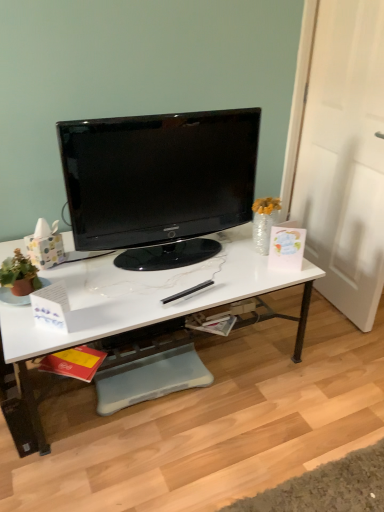
You are a GUI agent. You are given a task and a screenshot of the screen. Output one action in this format:
    pyautogui.click(x=<x>, y=<y>)
    Task: Click on the white marble desk at center
    
    Given the screenshot: What is the action you would take?
    pyautogui.click(x=145, y=304)

This screenshot has width=384, height=512. Describe the element at coordinates (145, 304) in the screenshot. I see `white marble desk at center` at that location.

What is the approximate height of white marble desk at center?

The height of white marble desk at center is 19.71 inches.

Where is `black glossy television at center`? black glossy television at center is located at coordinates (159, 183).

Image resolution: width=384 pixels, height=512 pixels. Describe the element at coordinates (159, 183) in the screenshot. I see `black glossy television at center` at that location.

I want to click on white marble desk at center, so click(145, 304).

Is black glossy television at center at the right side of white marble desk at center?

Indeed, black glossy television at center is positioned on the right side of white marble desk at center.

Which object is closer to the camera, black glossy television at center or white marble desk at center?

white marble desk at center is more forward.

Is point (143, 193) closer to camera compared to point (170, 313)?

No, it is not.

From the image's perspective, is black glossy television at center above or below white marble desk at center?

From the image's perspective, black glossy television at center appears above white marble desk at center.

From a real-world perspective, is black glossy television at center on white marble desk at center?

Yes, from a real-world perspective, black glossy television at center is on top of white marble desk at center.

Which of these two, black glossy television at center or white marble desk at center, is thinner?

With smaller width is black glossy television at center.

Considering the relative sizes of black glossy television at center and white marble desk at center in the image provided, is black glossy television at center shorter than white marble desk at center?

No.

In the scene shown: Is black glossy television at center bigger than white marble desk at center?

Actually, black glossy television at center might be smaller than white marble desk at center.

Is black glossy television at center not within white marble desk at center?

Indeed, black glossy television at center is completely outside white marble desk at center.

Looking at this image, is black glossy television at center directly adjacent to white marble desk at center?

black glossy television at center and white marble desk at center are not in contact.

In the scene shown: Is black glossy television at center looking in the opposite direction of white marble desk at center?

No, black glossy television at center is not facing the opposite direction of white marble desk at center.

Measure the distance from black glossy television at center to white marble desk at center.

black glossy television at center and white marble desk at center are 11.12 inches apart.

Where is `television that is on the right side of white marble desk at center`? television that is on the right side of white marble desk at center is located at coordinates (159, 183).

Based on their positions, is white marble desk at center located to the left or right of black glossy television at center?

white marble desk at center is to the left of black glossy television at center.

Is white marble desk at center in front of or behind black glossy television at center in the image?

white marble desk at center is in front of black glossy television at center.

Is point (282, 281) closer to viewer compared to point (253, 123)?

Yes, point (282, 281) is closer to viewer.

From the image's perspective, between white marble desk at center and black glossy television at center, who is located below?

white marble desk at center is shown below in the image.

From a real-world perspective, which object rests below the other?

From a 3D spatial view, white marble desk at center is below.

Between white marble desk at center and black glossy television at center, which one has larger width?

white marble desk at center.

Who is taller, white marble desk at center or black glossy television at center?

black glossy television at center.

Considering the relative sizes of white marble desk at center and black glossy television at center in the image provided, is white marble desk at center smaller than black glossy television at center?

No, white marble desk at center is not smaller than black glossy television at center.

Is white marble desk at center situated inside black glossy television at center or outside?

white marble desk at center lies outside black glossy television at center.

Is white marble desk at center not near black glossy television at center?

No, white marble desk at center is not far from black glossy television at center.

Could you tell me if white marble desk at center is turned towards black glossy television at center?

No, white marble desk at center is not aimed at black glossy television at center.

Locate an element on the screen. This screenshot has width=384, height=512. television above the white marble desk at center (from the image's perspective) is located at coordinates (159, 183).

This screenshot has height=512, width=384. Identify the location of television lying on the right of white marble desk at center. (159, 183).

This screenshot has width=384, height=512. In the image, there is a black glossy television at center. In order to click on desk below it (from the image's perspective) in this screenshot , I will do pos(145,304).